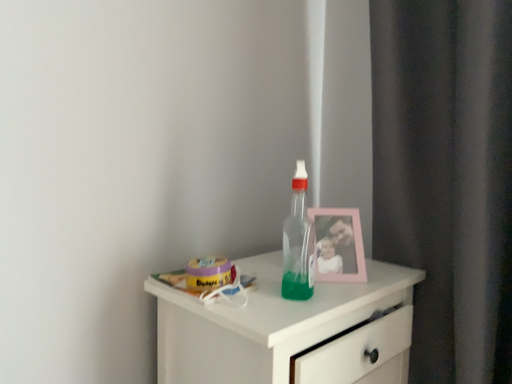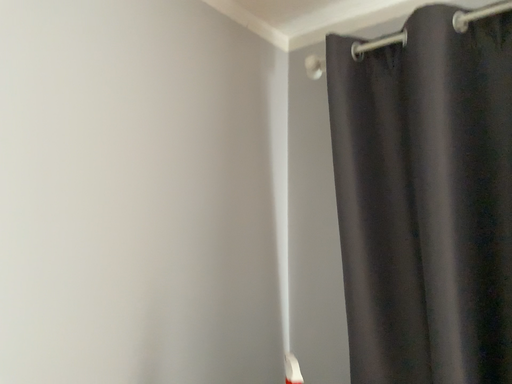
Question: How did the camera likely rotate when shooting the video?

Choices:
 (A) rotated upward
 (B) rotated downward

Answer: (A)